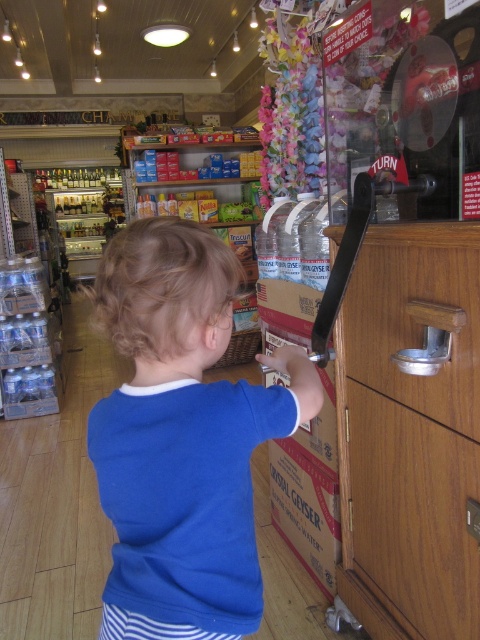
Who is more distant from viewer, (478, 579) or (394, 228)?

The point (394, 228) is behind.

Is wooden drawer at center below wooden at right?

Yes, wooden drawer at center is below wooden at right.

Between point (389, 440) and point (409, 397), which one is positioned in front?

Point (409, 397) is in front.

Image resolution: width=480 pixels, height=640 pixels. What are the coordinates of `wooden drawer at center` in the screenshot? It's located at (415, 513).

Does blue cotton shirt at center appear on the right side of wooden drawer at center?

In fact, blue cotton shirt at center is to the left of wooden drawer at center.

Does blue cotton shirt at center appear over wooden drawer at center?

Yes.

This screenshot has height=640, width=480. Describe the element at coordinates (181, 436) in the screenshot. I see `blue cotton shirt at center` at that location.

The image size is (480, 640). I want to click on blue cotton shirt at center, so click(x=181, y=436).

This screenshot has height=640, width=480. I want to click on blue cotton shirt at center, so click(181, 436).

Who is higher up, blue cotton shirt at center or wooden at right?

wooden at right is above.

Is point (231, 307) closer to camera compared to point (374, 269)?

That is False.

You are a GUI agent. You are given a task and a screenshot of the screen. Output one action in this format:
    pyautogui.click(x=<x>, y=<y>)
    Task: Click on the blue cotton shirt at center
    
    Given the screenshot: What is the action you would take?
    pyautogui.click(x=181, y=436)